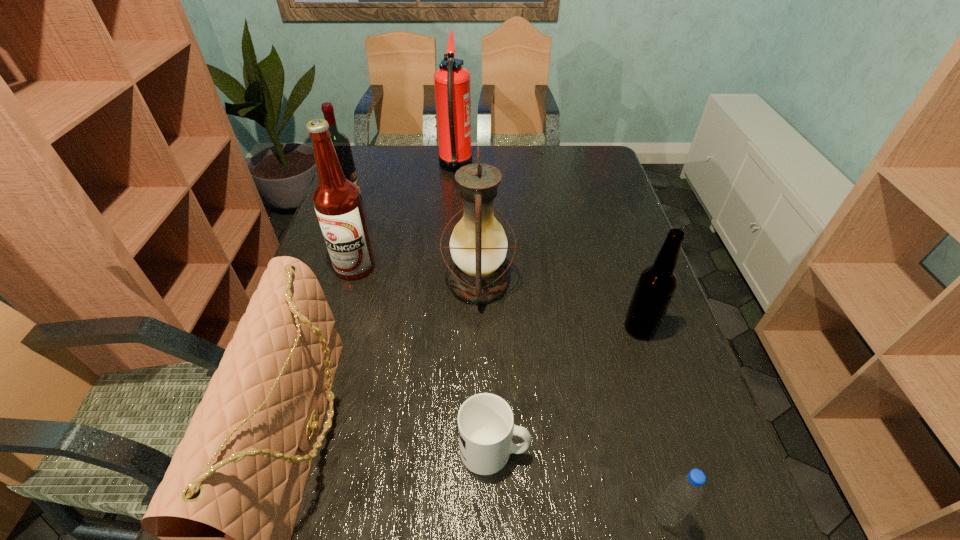
Locate an element on the screen. The image size is (960, 540). the nearer alcohol is located at coordinates (337, 201).

Find the location of a particular element. The width and height of the screenshot is (960, 540). the farthest object is located at coordinates (452, 81).

The width and height of the screenshot is (960, 540). Identify the location of oil lamp. click(478, 244).

Find the location of `the second farthest object`. the second farthest object is located at coordinates (341, 143).

Locate an element on the screen. The width and height of the screenshot is (960, 540). the shorter alcohol is located at coordinates (341, 143).

Where is `beer bottle`? beer bottle is located at coordinates (655, 288).

Where is `the seventh tallest object`? This screenshot has width=960, height=540. the seventh tallest object is located at coordinates (685, 491).

At what (x,y) coordinates should I click in order to perform the action: click on mug. Please return your answer as a coordinate pair (x, y). The image size is (960, 540). Looking at the image, I should click on (485, 421).

Locate an element on the screen. The height and width of the screenshot is (540, 960). vacant space located 0.260m on the label side of the nearer alcohol is located at coordinates (327, 364).

Locate an element on the screen. The height and width of the screenshot is (540, 960). free space located at the nozzle of the fire extinguisher is located at coordinates (516, 168).